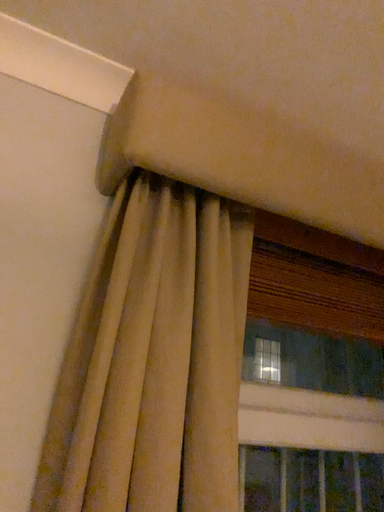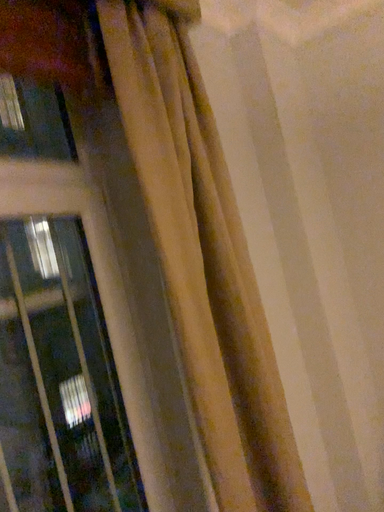
Question: How did the camera likely rotate when shooting the video?

Choices:
 (A) rotated upward
 (B) rotated downward

Answer: (B)